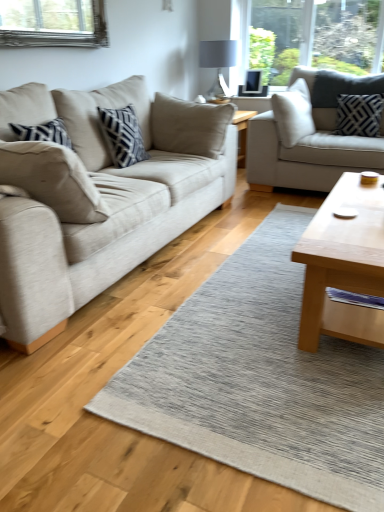
What are the coordinates of `empty space that is ontop of textured gray rug at center (from a real-world perspective)` in the screenshot? It's located at (268, 298).